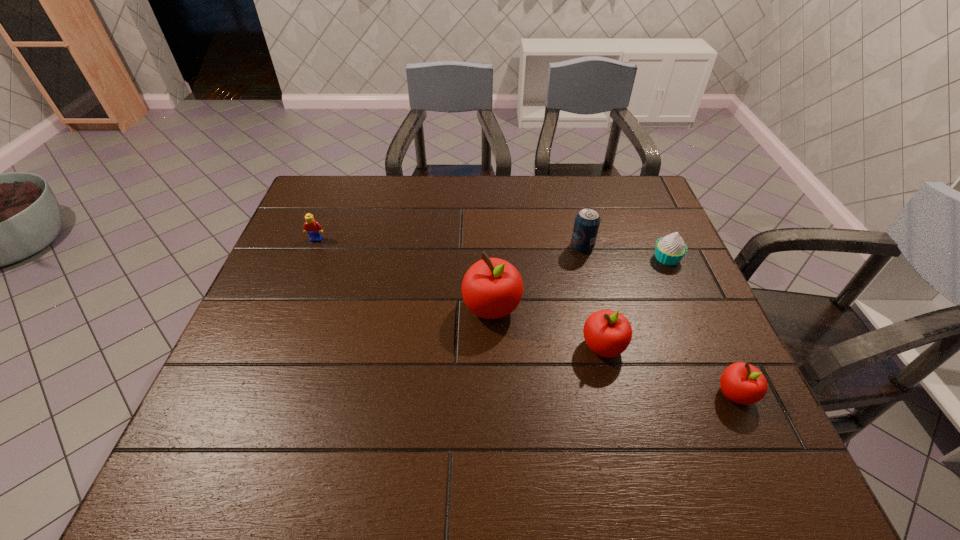
Identify the location of vacant space at the near edge. (415, 404).

You are a GUI agent. You are given a task and a screenshot of the screen. Output one action in this format:
    pyautogui.click(x=<x>, y=<y>)
    Task: Click on the free space at the left edge of the desktop
    
    Given the screenshot: What is the action you would take?
    pyautogui.click(x=333, y=244)

The image size is (960, 540). In the image, there is a desktop. What are the coordinates of `vacant space at the right edge` in the screenshot? It's located at (626, 264).

What are the coordinates of `vacant area at the near left corner of the desktop` in the screenshot? It's located at (245, 416).

Find the location of a particular element. This screenshot has width=960, height=540. vacant space at the far right corner of the desktop is located at coordinates (628, 194).

At what (x,y) coordinates should I click in order to perform the action: click on empty space between the leftmost object and the leftmost apple. Please return your answer as a coordinate pair (x, y). Image resolution: width=960 pixels, height=540 pixels. Looking at the image, I should click on (404, 273).

Locate an element on the screen. The width and height of the screenshot is (960, 540). free space between the second tallest apple and the nearest object is located at coordinates (669, 370).

Locate an element on the screen. free space between the tallest object and the pop soda is located at coordinates (537, 277).

In order to click on vacant point located between the pop soda and the second apple from left to right in this screenshot , I will do `click(592, 296)`.

In order to click on free point between the Lego and the rightmost apple in this screenshot , I will do `click(526, 316)`.